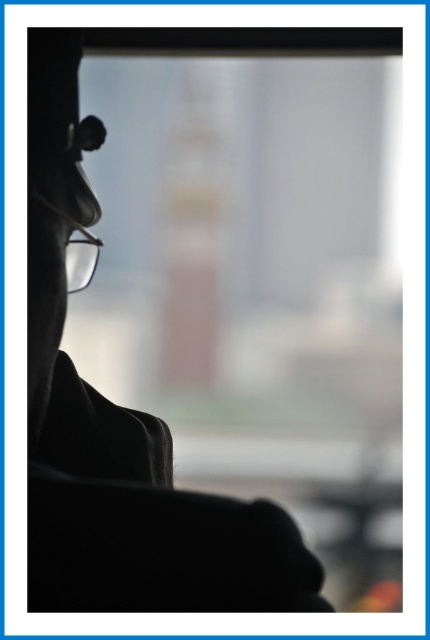
Question: Is silhouette coat at left thinner than transparent plastic glasses at left?

Choices:
 (A) yes
 (B) no

Answer: (B)

Question: Which point is closer to the camera taking this photo?

Choices:
 (A) (172, 504)
 (B) (82, 180)

Answer: (A)

Question: Which point is closer to the camera taking this photo?

Choices:
 (A) (89, 129)
 (B) (134, 548)

Answer: (B)

Question: Can you confirm if silhouette coat at left is thinner than transparent plastic glasses at left?

Choices:
 (A) yes
 (B) no

Answer: (B)

Question: Can you confirm if silhouette coat at left is thinner than transparent plastic glasses at left?

Choices:
 (A) yes
 (B) no

Answer: (B)